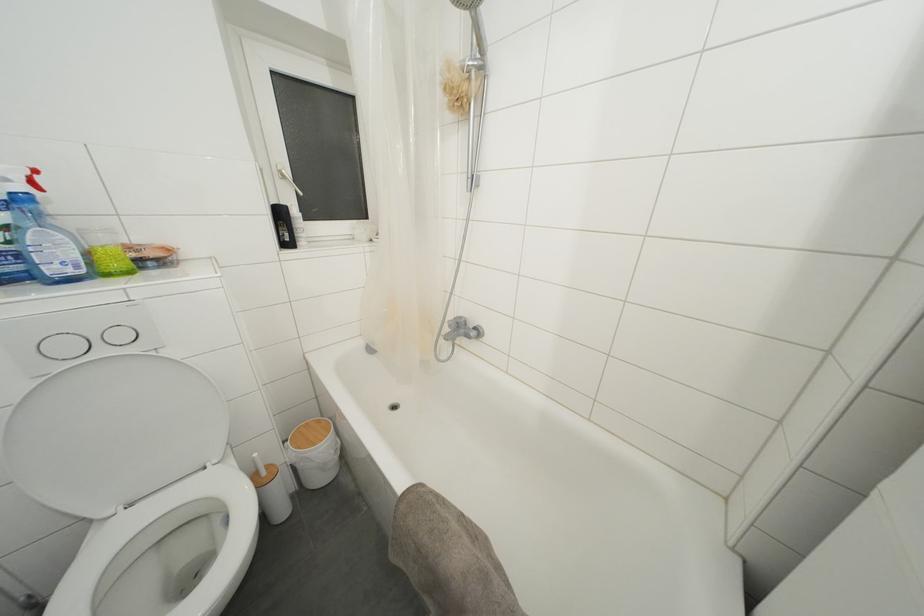
In order to click on silver shower head in this screenshot , I will do `click(478, 33)`.